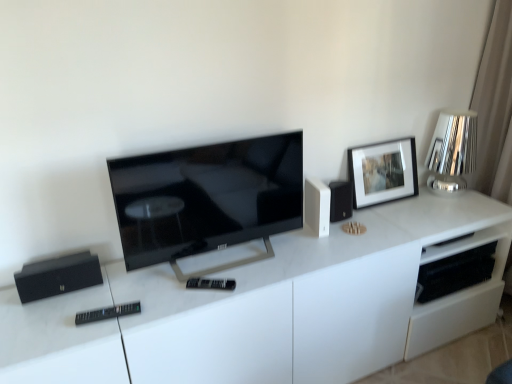
At what (x,y) coordinates should I click in order to perform the action: click on free space between black matte speaker at left and black plastic remote at center, which ranks as the first remote in top-to-bottom order. Please return your answer as a coordinate pair (x, y). This screenshot has width=512, height=384. Looking at the image, I should click on (135, 290).